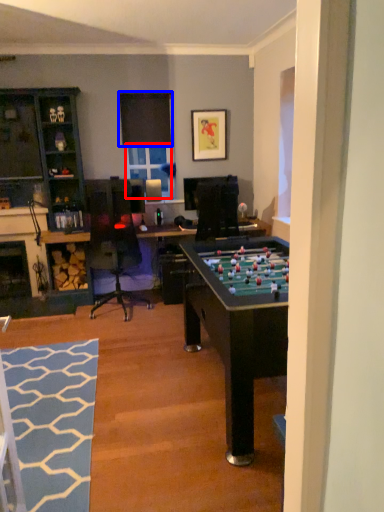
Question: Among these objects, which one is nearest to the camera, window screen (highlighted by a red box) or window screen (highlighted by a blue box)?

Choices:
 (A) window screen
 (B) window screen

Answer: (B)